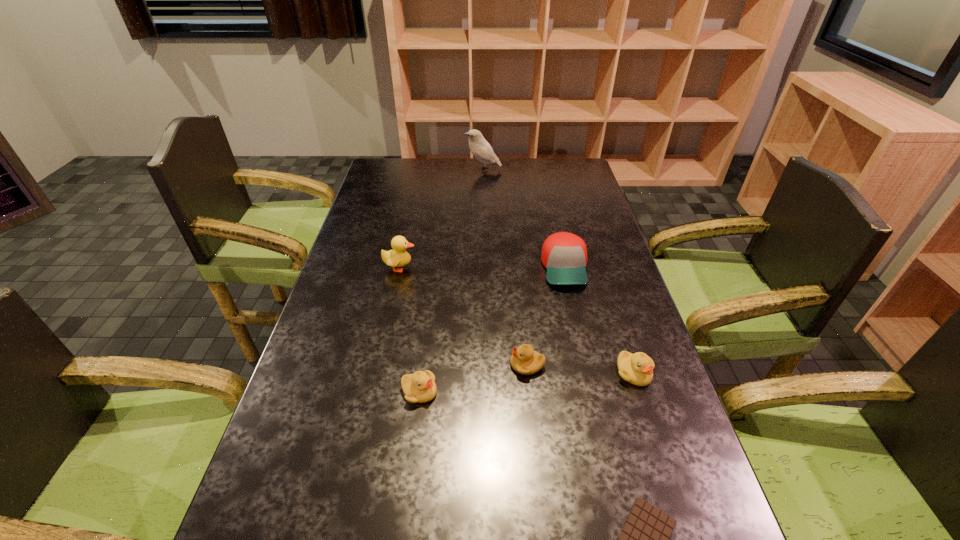
At what (x,y) coordinates should I click in order to perform the action: click on vacant point located between the rightmost duckling and the third tallest object. Please return your answer as a coordinate pair (x, y). Looking at the image, I should click on (599, 320).

The image size is (960, 540). Identify the location of free space between the bird and the second duckling from left to right. coord(451,281).

At what (x,y) coordinates should I click in order to perform the action: click on free space between the tallest object and the third duckling from left to right. Please return your answer as a coordinate pair (x, y). The width and height of the screenshot is (960, 540). Looking at the image, I should click on 505,267.

Locate an element on the screen. empty space between the leftmost object and the third tallest object is located at coordinates (482, 268).

Locate which object ranks fourth in proximity to the rightmost duckling. Please provide its 2D coordinates. Your answer should be formatted as a tuple, i.e. [(x, y)], where the tuple contains the x and y coordinates of a point satisfying the conditions above.

[(419, 387)]

This screenshot has height=540, width=960. In order to click on object that stands as the second closest to the sixth object from right to left in this screenshot , I will do `click(398, 257)`.

Find the location of a particular element. duckling that is the closest one to the tallest object is located at coordinates (398, 257).

Identify which duckling is the third nearest to the third duckling from right to left. Please provide its 2D coordinates. Your answer should be formatted as a tuple, i.e. [(x, y)], where the tuple contains the x and y coordinates of a point satisfying the conditions above.

[(637, 368)]

This screenshot has width=960, height=540. I want to click on vacant space that satisfies the following two spatial constraints: 1. at the brim of the baseball cap; 2. on the front-facing side of the sixth object from right to left, so pos(592,392).

The height and width of the screenshot is (540, 960). Find the location of `free space that satisfies the following two spatial constraints: 1. at the brim of the third tallest object; 2. on the front-facing side of the third duckling from right to left`. free space that satisfies the following two spatial constraints: 1. at the brim of the third tallest object; 2. on the front-facing side of the third duckling from right to left is located at coordinates (592, 392).